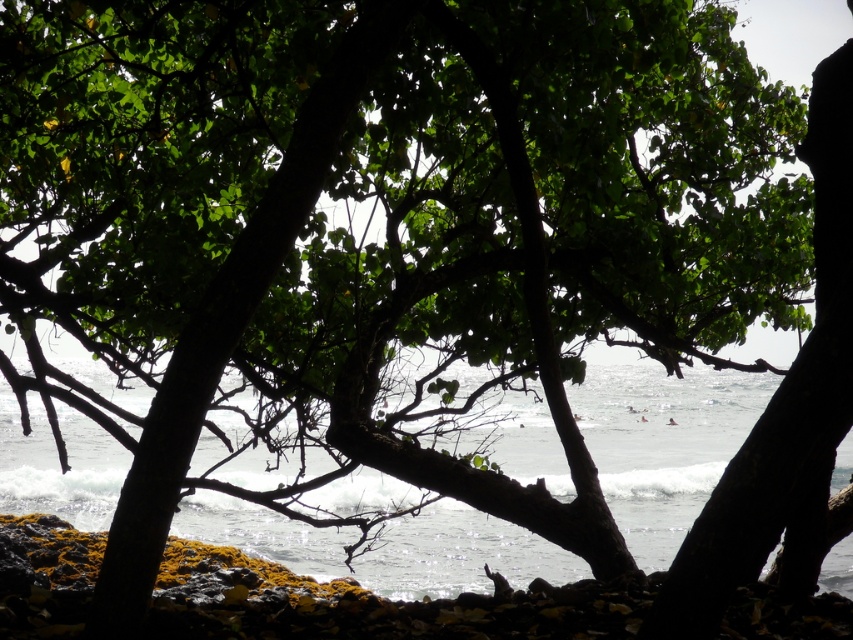
Question: Which object is closer to the camera taking this photo?

Choices:
 (A) clear water at center
 (B) green mossy rocks at lower center

Answer: (A)

Question: Which of the following is the closest to the observer?

Choices:
 (A) (108, 460)
 (B) (223, 614)

Answer: (B)

Question: Considering the relative positions of clear water at center and green mossy rocks at lower center in the image provided, where is clear water at center located with respect to green mossy rocks at lower center?

Choices:
 (A) below
 (B) above

Answer: (B)

Question: Can you confirm if clear water at center is thinner than green mossy rocks at lower center?

Choices:
 (A) yes
 (B) no

Answer: (B)

Question: Is clear water at center further to camera compared to green mossy rocks at lower center?

Choices:
 (A) no
 (B) yes

Answer: (A)